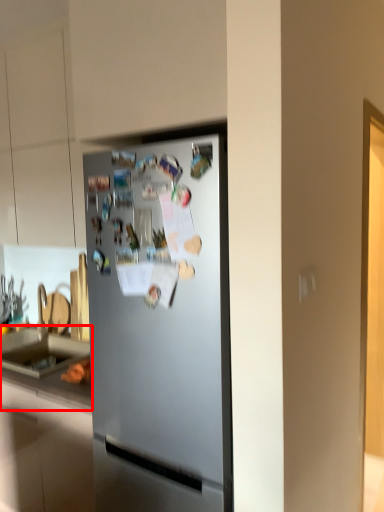
Question: Observing the image, what is the correct spatial positioning of counter top (annotated by the red box) in reference to refrigerator?

Choices:
 (A) left
 (B) right

Answer: (A)